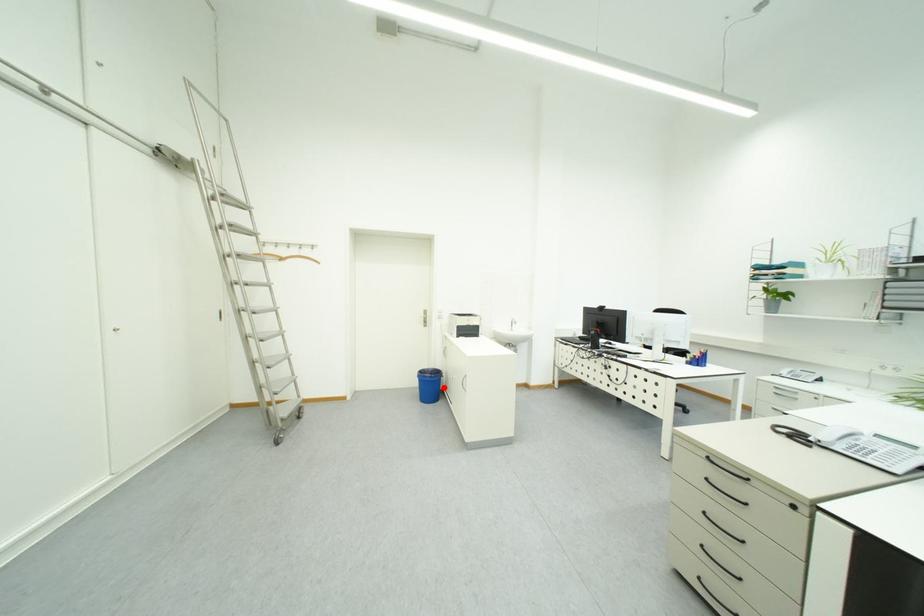
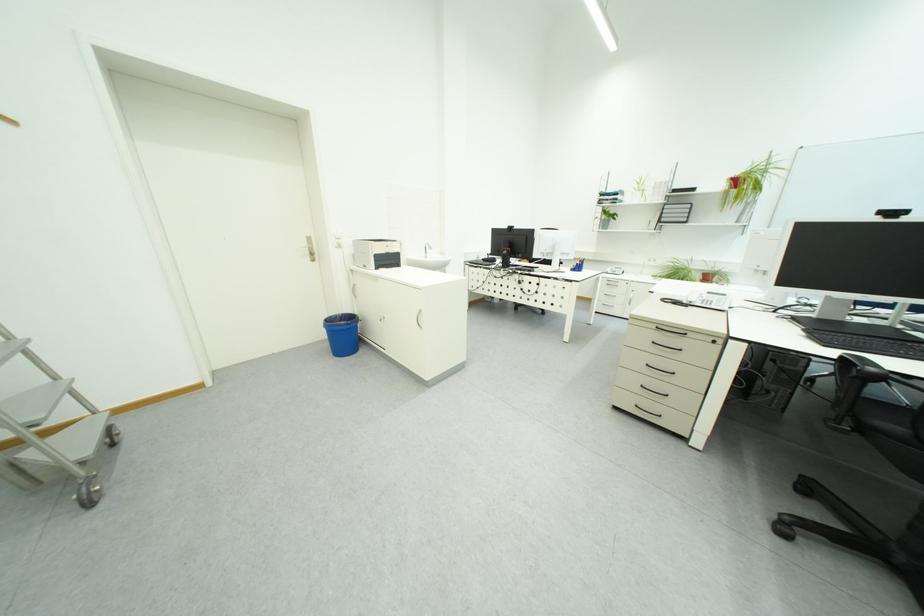
In the second image, find the point that corresponds to the highlighted location in the first image.

(358, 336)